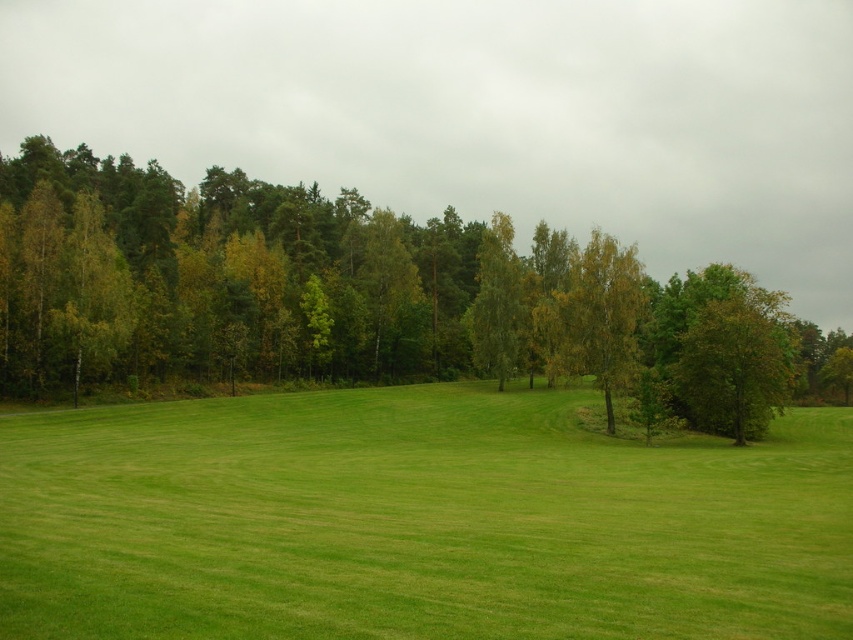
Is green grass at center closer to camera compared to green leafy tree at center?

Yes.

Is point (627, 600) behind point (369, 337)?

No, it is not.

Where is `green grass at center`? This screenshot has height=640, width=853. green grass at center is located at coordinates (416, 522).

Looking at this image, which of these two, green grass at center or green leafy tree at right, stands shorter?

green grass at center is shorter.

Who is positioned more to the right, green grass at center or green leafy tree at right?

Positioned to the right is green leafy tree at right.

Is point (61, 534) in front of point (700, 323)?

Yes, it is in front of point (700, 323).

Identify the location of green grass at center. (416, 522).

Can you confirm if green leafy tree at center is shorter than green leafy tree at right?

No, green leafy tree at center is not shorter than green leafy tree at right.

At what (x,y) coordinates should I click in order to perform the action: click on green leafy tree at center. Please return your answer as a coordinate pair (x, y). Looking at the image, I should click on (358, 296).

Where is `green leafy tree at center`? The height and width of the screenshot is (640, 853). green leafy tree at center is located at coordinates (358, 296).